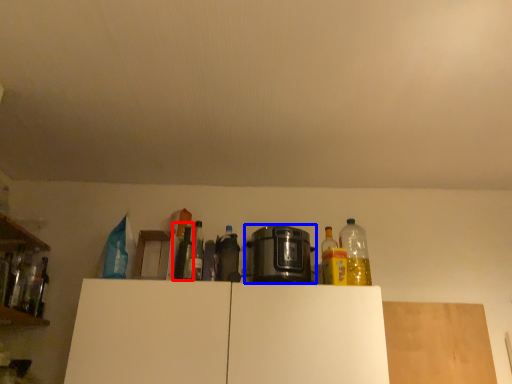
Question: Among these objects, which one is farthest to the camera, bottle (highlighted by a red box) or home appliance (highlighted by a blue box)?

Choices:
 (A) bottle
 (B) home appliance

Answer: (A)